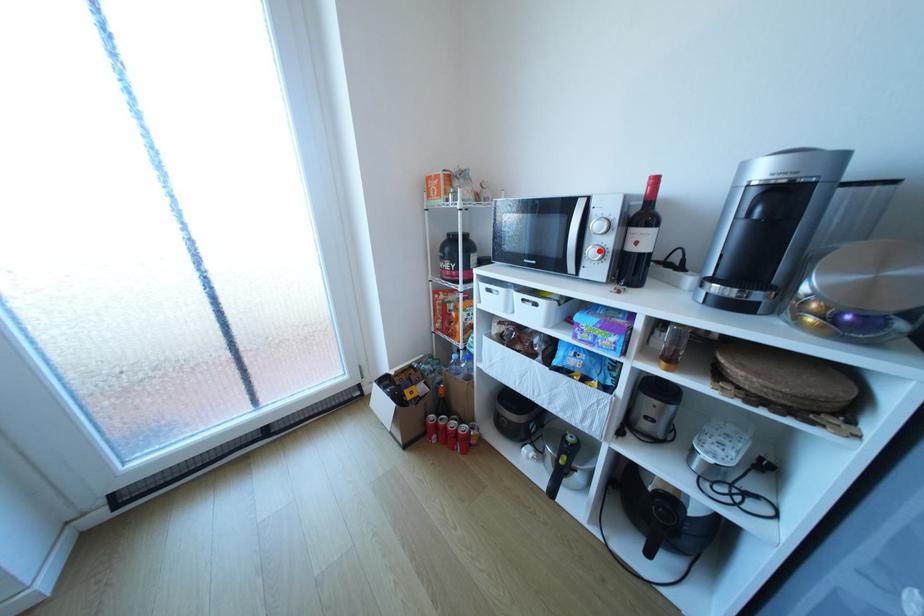
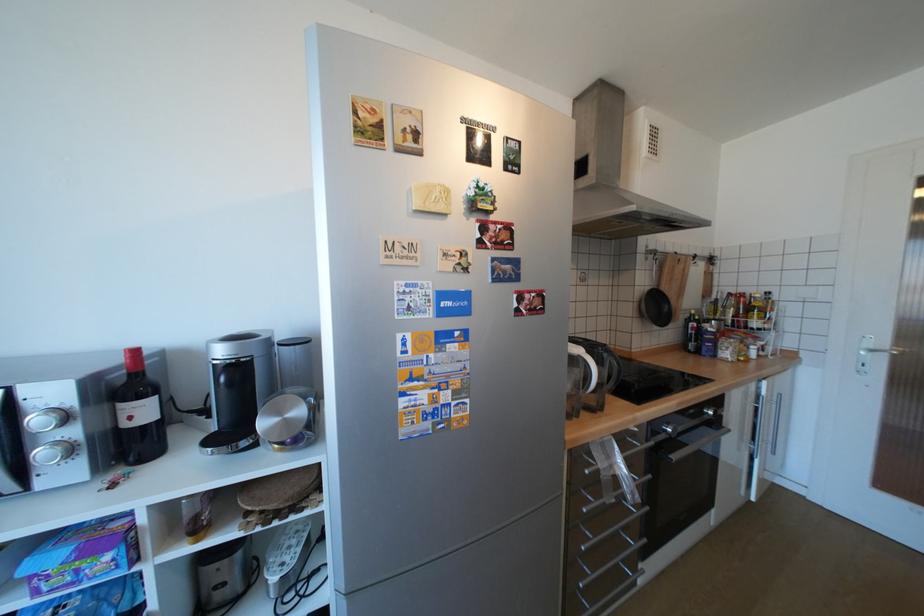
Where in the second image is the point corresponding to the highlighted location from the first image?

(52, 453)